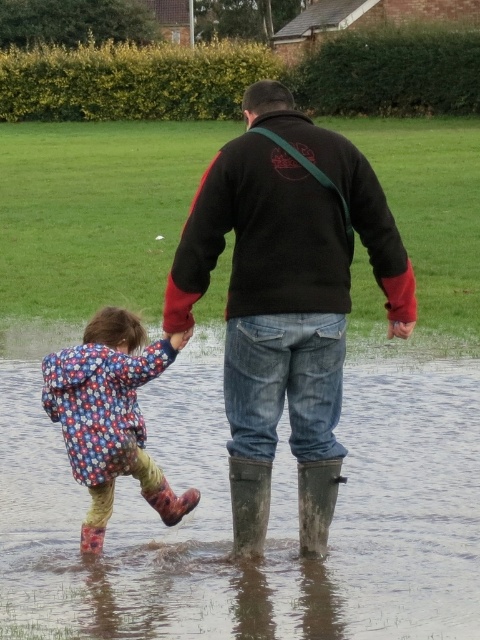
Between muddy rubber boots at lower center and floral-patterned rubber boots at lower left, which one appears on the left side from the viewer's perspective?

From the viewer's perspective, muddy rubber boots at lower center appears more on the left side.

Can you confirm if muddy rubber boots at lower center is bigger than floral-patterned rubber boots at lower left?

No, muddy rubber boots at lower center is not bigger than floral-patterned rubber boots at lower left.

Does point (183, 356) come behind point (143, 440)?

Yes, it is.

Where is `muddy rubber boots at lower center`? The image size is (480, 640). muddy rubber boots at lower center is located at coordinates (269, 513).

The width and height of the screenshot is (480, 640). In order to click on dark brown leather jacket at center in this screenshot , I will do point(287,273).

Is dark brown leather jacket at center wider than muddy rubber boot at lower center?

Indeed, dark brown leather jacket at center has a greater width compared to muddy rubber boot at lower center.

Is point (239, 148) positioned in front of point (312, 470)?

Yes.

This screenshot has width=480, height=640. In order to click on dark brown leather jacket at center in this screenshot , I will do `click(287, 273)`.

Between muddy rubber boots at lower center and rubber/muddy boot at lower center, which one is positioned higher?

rubber/muddy boot at lower center

The image size is (480, 640). What are the coordinates of `muddy rubber boots at lower center` in the screenshot? It's located at (269, 513).

The height and width of the screenshot is (640, 480). I want to click on muddy rubber boots at lower center, so click(269, 513).